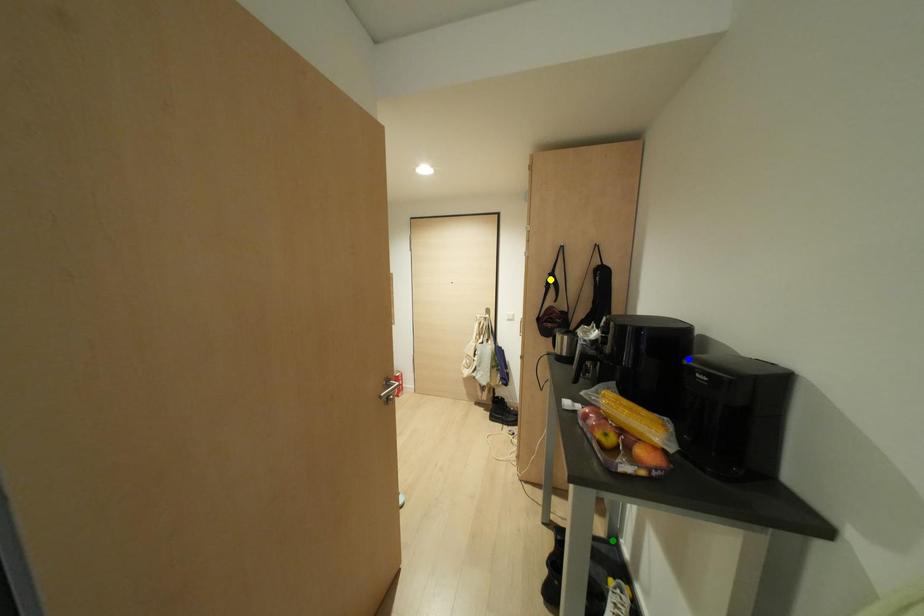
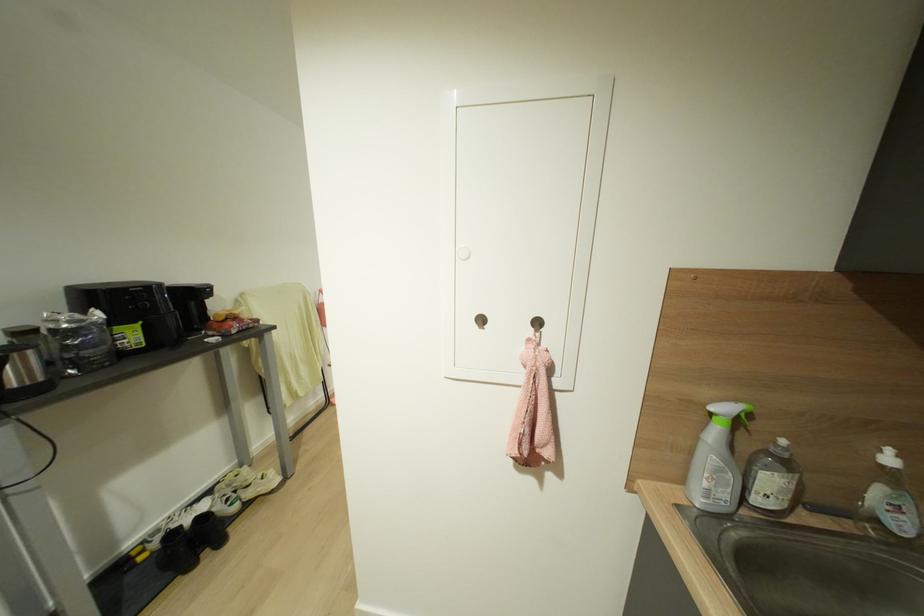
I am providing you with two images of the same scene from different viewpoints. Three points are marked in image1. Which point corresponds to a part or object that is occluded in image2?In image1, three points are marked. Which of them correspond to a part or object that is occluded in image2?Among the three points shown in image1, which one corresponds to a part or object that is no longer visible due to occlusion in image2?

yellow point, green point, blue point cannot be seen in image2.